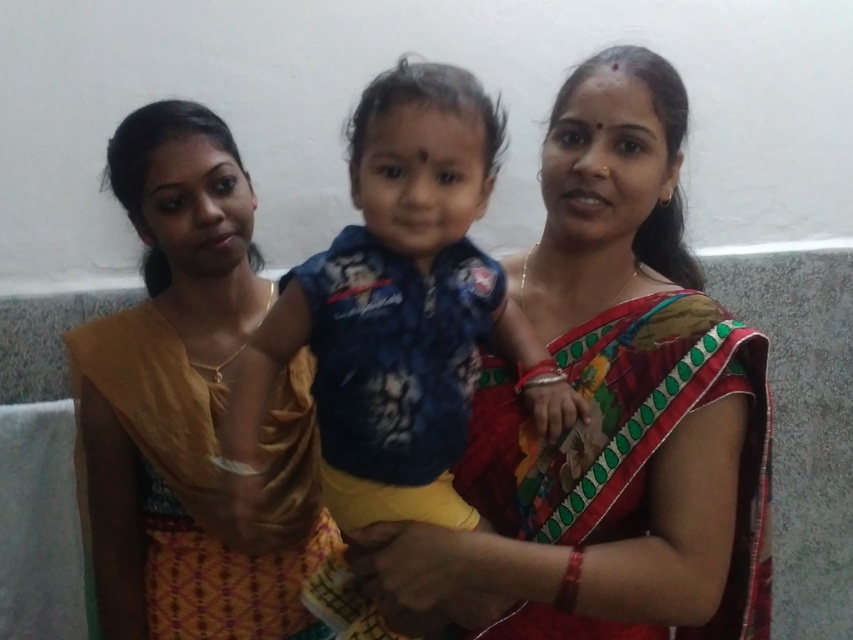
You are a photographer setting up for a group photo. You need to ensure that the distance between the matte yellow saree at left and the blue cotton shirt at center is at least 12 inches to avoid overcrowding. Based on the scene description, is the current spacing sufficient?

The matte yellow saree at left is 11.19 inches from the blue cotton shirt at center, which is less than the required 12 inches. Therefore, the current spacing is insufficient to avoid overcrowding.

You are a photographer setting up a shoot in a room with three people. You need to position a light to the right of the blue cotton shirt at center but still to the left of the matte yellow saree at left. Is this possible?

The matte yellow saree at left is to the left of the blue cotton shirt at center. Therefore, positioning a light to the right of the blue cotton shirt at center but still to the left of the matte yellow saree at left is not possible because the saree is already positioned to the left of the shirt.